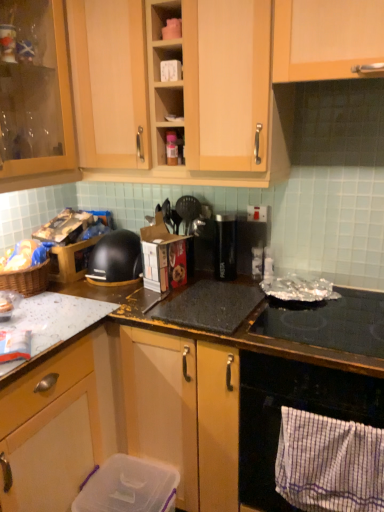
Locate an element on the screen. The image size is (384, 512). free space on the front side of black matte bowl at center-left is located at coordinates (97, 297).